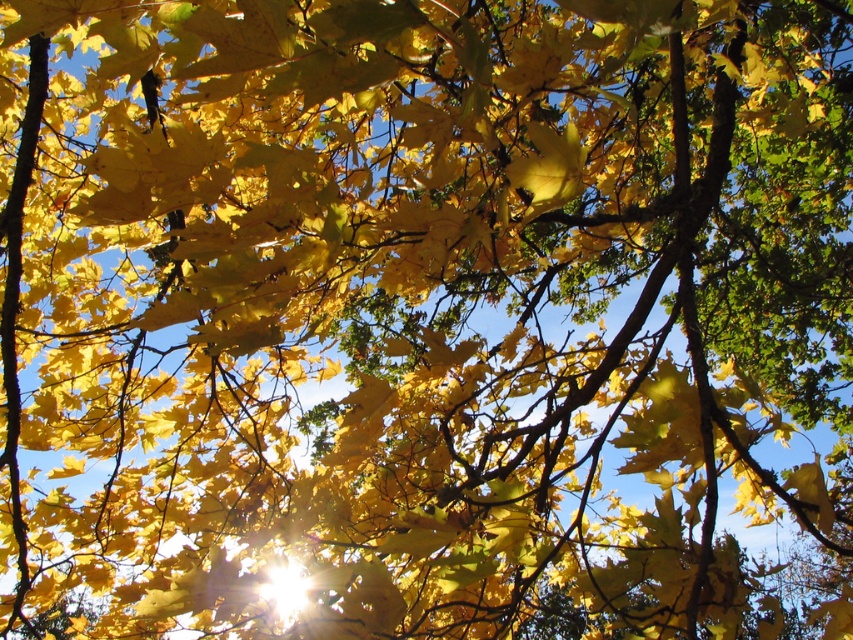
You are an artist sketching the autumn tree scene. You notice two yellow matte leaves in your viewfinder. Which leaf is closer to the viewer, the yellow matte leaf at upper left or the yellow matte leaf at center?

The yellow matte leaf at upper left is closer to the viewer because it is positioned over the yellow matte leaf at center, indicating it is in front.

You are a bird flying towards the tree and want to land on a leaf. You see the yellow matte leaf at upper left and the yellow matte leaf at center. Which leaf is closer to your current position?

The yellow matte leaf at upper left is closer to your current position since it is only 54.05 centimeters away from the yellow matte leaf at center, but without knowing the exact distance from your current position to each leaf, it is impossible to determine which is closer. However, based on their relative positions, if you are approaching the tree from above or the left side, the yellow matte leaf at upper left might be nearer.